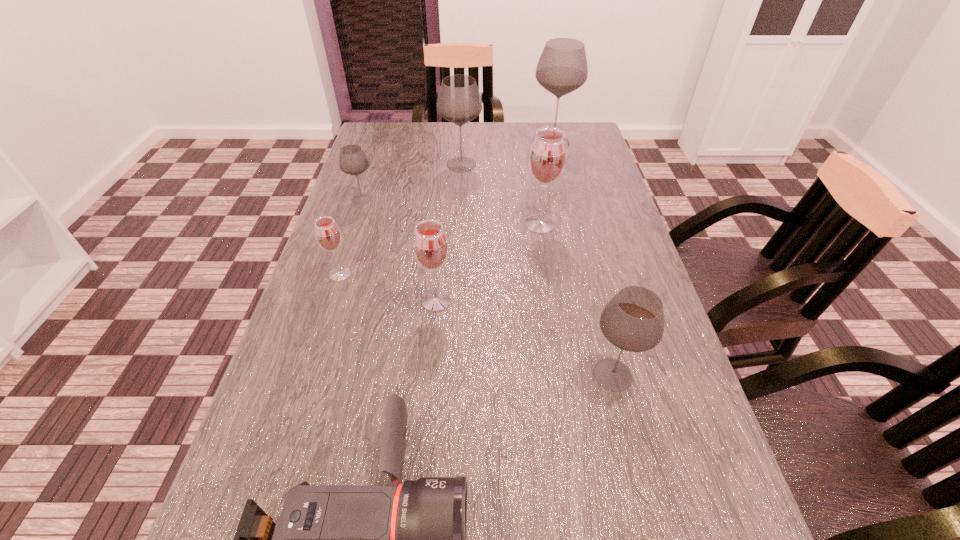
Find the location of a particular element. The image size is (960, 540). object that is at the far right corner is located at coordinates (562, 68).

The width and height of the screenshot is (960, 540). What are the coordinates of `vacant space at the far edge of the desktop` in the screenshot? It's located at (459, 150).

The image size is (960, 540). Identify the location of vacant position at the left edge of the desktop. (350, 396).

The height and width of the screenshot is (540, 960). What are the coordinates of `free space at the right edge` in the screenshot? It's located at (621, 263).

Find the location of a particular element. This screenshot has width=960, height=540. vacant point located between the second gray wineglass from left to right and the biggest gray wineglass is located at coordinates (507, 153).

This screenshot has height=540, width=960. In order to click on free area in between the tallest wineglass and the fourth nearest object in this screenshot , I will do `click(446, 208)`.

Identify which object is located as the third nearest to the camcorder. Please provide its 2D coordinates. Your answer should be formatted as a tuple, i.e. [(x, y)], where the tuple contains the x and y coordinates of a point satisfying the conditions above.

[(328, 236)]

At what (x,y) coordinates should I click in order to perform the action: click on object that is the fourth closest one to the second nearest gray wineglass. Please return your answer as a coordinate pair (x, y). The height and width of the screenshot is (540, 960). Looking at the image, I should click on (547, 157).

Locate an element on the screen. Image resolution: width=960 pixels, height=540 pixels. wineglass that is the fifth closest to the third smallest gray wineglass is located at coordinates (430, 245).

Locate which wineglass ranks sixth in proximity to the second nearest gray wineglass. Please provide its 2D coordinates. Your answer should be formatted as a tuple, i.e. [(x, y)], where the tuple contains the x and y coordinates of a point satisfying the conditions above.

[(633, 320)]